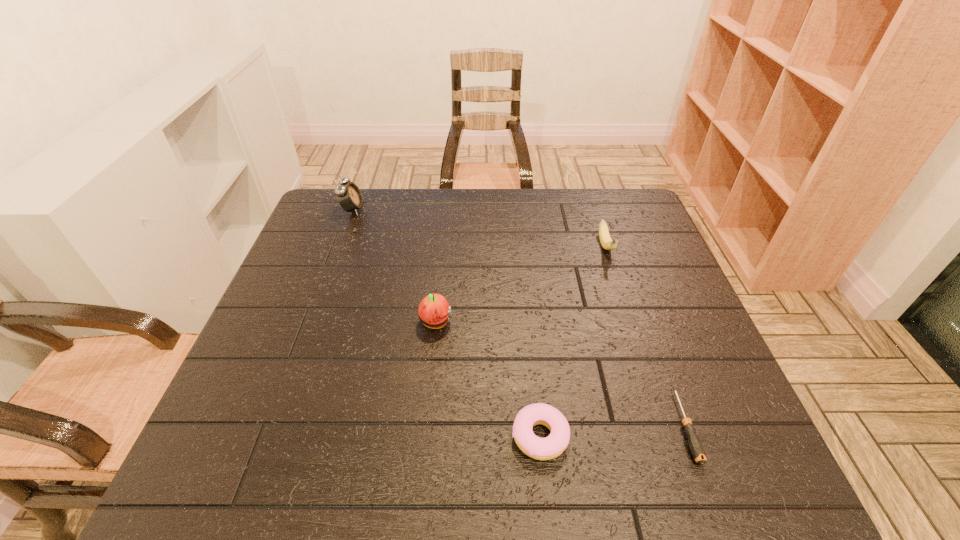
Where is `free space between the leftmost object and the fourth nearest object`? free space between the leftmost object and the fourth nearest object is located at coordinates (479, 228).

Where is `vacant area that lies between the leftmost object and the screwdriver`? vacant area that lies between the leftmost object and the screwdriver is located at coordinates (519, 318).

Locate which object is the closest to the apple. Please provide its 2D coordinates. Your answer should be formatted as a tuple, i.e. [(x, y)], where the tuple contains the x and y coordinates of a point satisfying the conditions above.

[(552, 446)]

Identify which object is located as the second nearest to the shortest object. Please provide its 2D coordinates. Your answer should be formatted as a tuple, i.e. [(x, y)], where the tuple contains the x and y coordinates of a point satisfying the conditions above.

[(607, 243)]

At what (x,y) coordinates should I click in order to perform the action: click on vacant space that satisfies the following two spatial constraints: 1. on the face of the leftmost object; 2. on the back side of the fourth object from right to left. Please return your answer as a coordinate pair (x, y). The image size is (960, 540). Looking at the image, I should click on (311, 323).

What are the coordinates of `free point that satisfies the following two spatial constraints: 1. on the face of the tallest object; 2. on the left side of the screwdriver` in the screenshot? It's located at (274, 426).

This screenshot has width=960, height=540. What are the coordinates of `free space in the image that satisfies the following two spatial constraints: 1. on the face of the third nearest object; 2. on the left side of the tallest object` in the screenshot? It's located at (311, 323).

Identify the location of vacant space that satisfies the following two spatial constraints: 1. on the face of the leftmost object; 2. on the back side of the second shortest object. Image resolution: width=960 pixels, height=540 pixels. (270, 436).

What are the coordinates of `free point that satisfies the following two spatial constraints: 1. at the stem of the screwdriver; 2. on the left side of the second farthest object` in the screenshot? It's located at (664, 426).